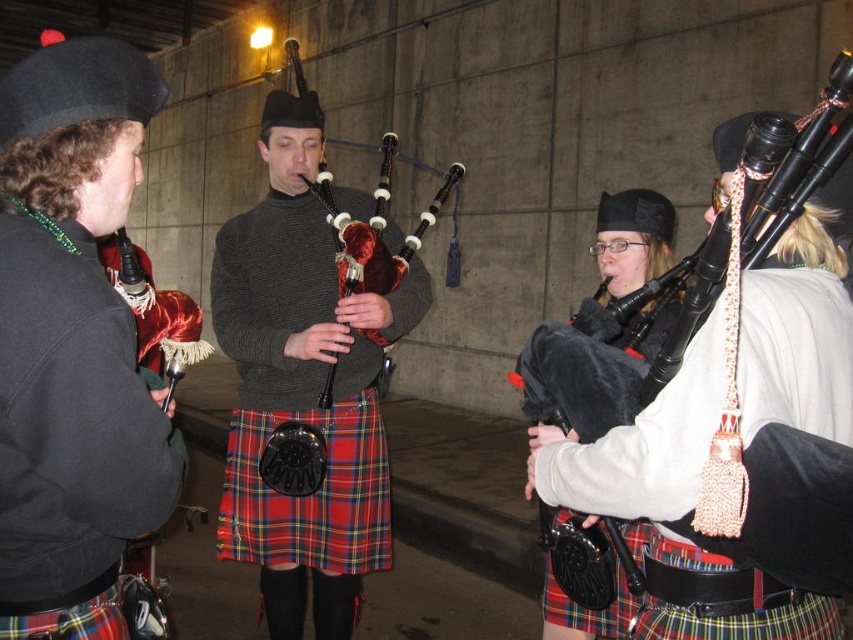
You are a photographer trying to capture a clear shot of the matte black bagpipe at center. However, the matte black beret at left is blocking your view. Can you move the beret to the side to get an unobstructed view of the bagpipe?

The matte black beret at left is in front of the matte black bagpipe at center, so moving the beret to the side would allow an unobstructed view of the bagpipe.

You are standing in the indoor setting where the bagpipe players are positioned. You notice a point marked at coordinates (311, 493). Which object does this point correspond to?

The point at coordinates (311, 493) corresponds to the tartan fabric kilt at center.

You are a photographer setting up a shot of the group. You need to ensure that the tartan fabric kilt at center and the red plaid kilt at lower left are both visible in the frame. Given their height difference, which kilt might require you to adjust your camera angle to avoid being blocked by the other?

The tartan fabric kilt at center is much taller than the red plaid kilt at lower left, so you may need to lower the camera angle to ensure the shorter red plaid kilt at lower left is visible and not blocked by the taller tartan fabric kilt at center.